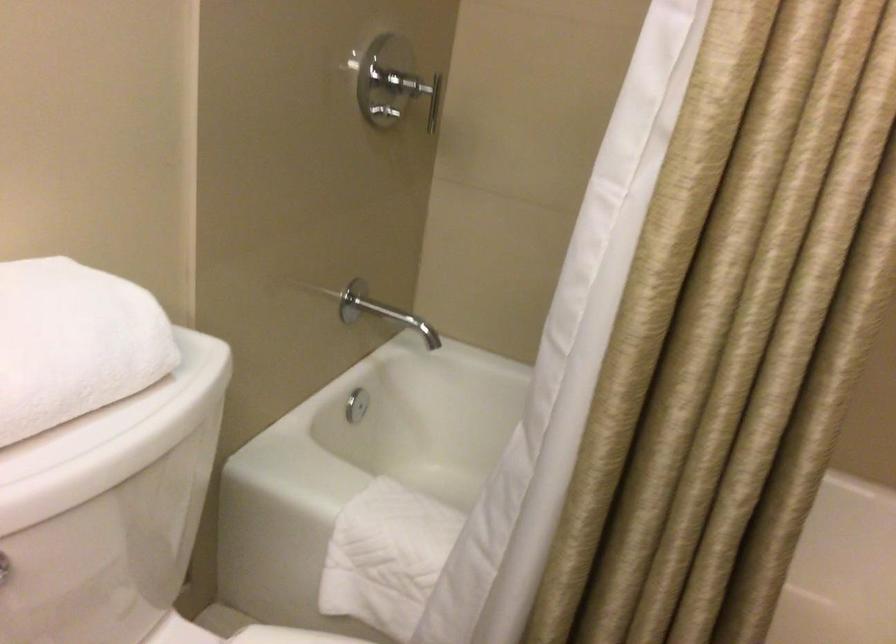
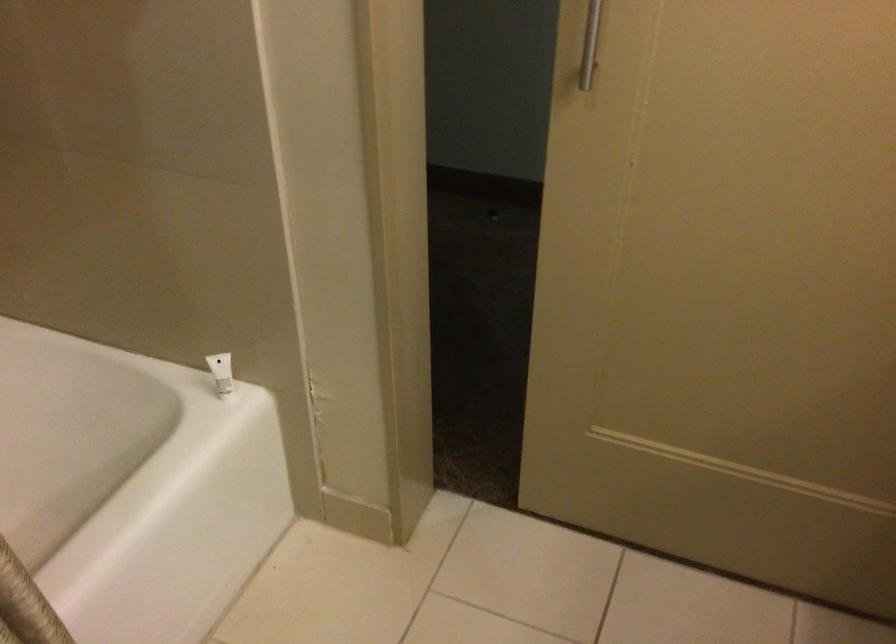
From the picture: Based on the continuous images, in which direction is the camera rotating?

The rotation direction of the camera is right-down.